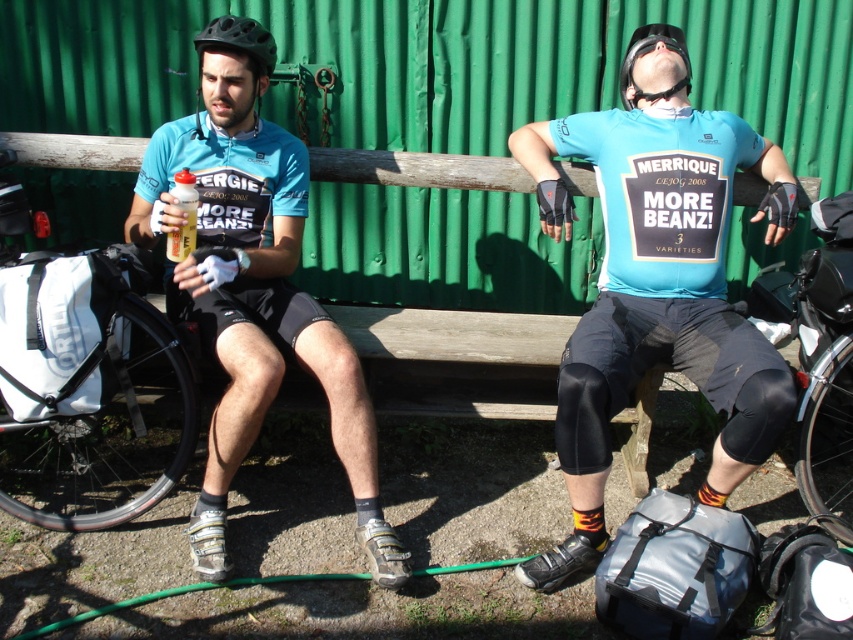
You are designing a poster for a cycling event and need to highlight the two items mentioned. Since the matte blue jersey at left and the black matte helmet at upper left are both important, which one should be placed higher up on the poster to maintain their visual hierarchy based on their sizes in the original image?

The matte blue jersey at left should be placed higher up on the poster since it is much taller than the black matte helmet at upper left, ensuring their visual hierarchy reflects their size relationship in the original image.

You are standing in front of the two cyclists resting on the bench. You notice two points marked on the ground near their feet. The first point is at coordinates point [210,246] and the second is at point [207,36]. From your perspective, which point is closer to you?

Point [210,246] is further to the camera than point [207,36], so the point closer to you is point [207,36].

You are a photographer trying to capture both the matte black helmet at left and the black matte helmet at upper left in a single shot. Since you want both helmets to appear as large as possible in the photo, which helmet should you focus on to ensure it appears larger in the frame?

The matte black helmet at left is taller than the black matte helmet at upper left, so focusing on the matte black helmet at left will make it appear larger in the frame.